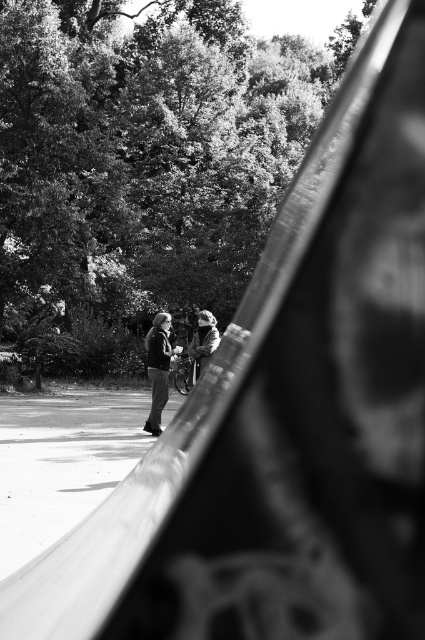
Which is behind, point (166, 330) or point (204, 337)?

The point (166, 330) is behind.

Is point (152, 417) closer to camera compared to point (204, 364)?

Yes, it is.

Where is `dark gray jacket at center`? The image size is (425, 640). dark gray jacket at center is located at coordinates (158, 369).